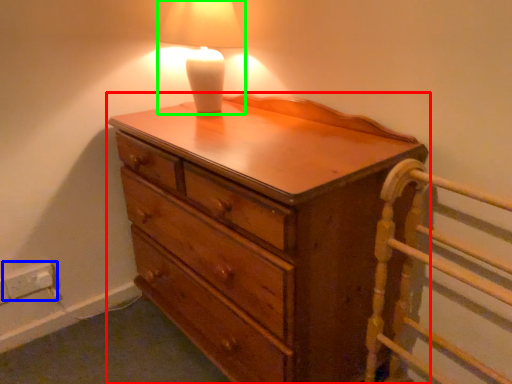
Question: Which object is positioned closest to chest of drawers (highlighted by a red box)? Select from electric outlet (highlighted by a blue box) and lamp (highlighted by a green box).

Choices:
 (A) electric outlet
 (B) lamp

Answer: (B)